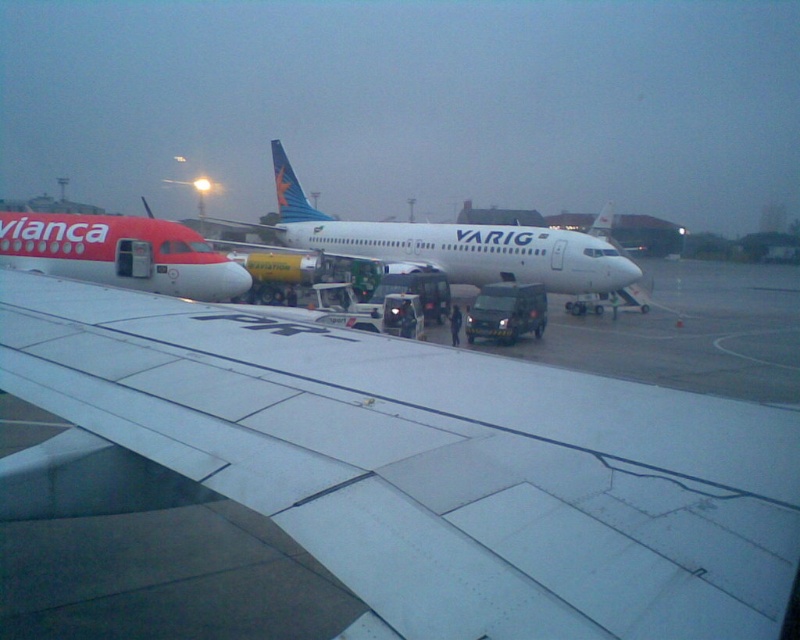
Question: Which object is positioned farthest from the white glossy airplane at center?

Choices:
 (A) white matte wing at center
 (B) matte red airplane at left

Answer: (A)

Question: From the image, what is the correct spatial relationship of white matte wing at center in relation to matte red airplane at left?

Choices:
 (A) below
 (B) above

Answer: (A)

Question: Does white matte wing at center appear under white glossy airplane at center?

Choices:
 (A) yes
 (B) no

Answer: (A)

Question: Does white glossy airplane at center have a lesser width compared to matte red airplane at left?

Choices:
 (A) yes
 (B) no

Answer: (B)

Question: Which of the following is the closest to the observer?

Choices:
 (A) white matte wing at center
 (B) matte red airplane at left

Answer: (A)

Question: Which of the following is the closest to the observer?

Choices:
 (A) matte red airplane at left
 (B) white glossy airplane at center
 (C) white matte wing at center

Answer: (C)